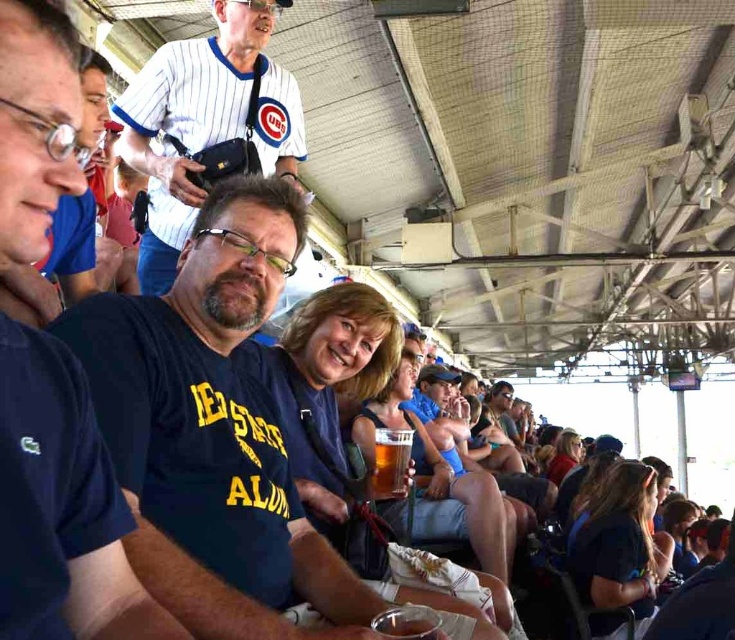
You are standing at the point labeled point (x=154, y=148) in the baseball stadium. If you want to take a photo of the entire stadium, where should you position yourself relative to this point?

You should move away from the point labeled point (x=154, y=148) because the camera is currently 13.86 feet away from this point, which might be too close to capture the entire stadium in one frame.

You are a photographer standing at the center of the baseball stadium. You notice two points marked in the image. The first point is at coordinate point (223, 579) and the second is at point (118, 579). If you want to take a photo that includes both points, which point should you focus on first to ensure both are in focus?

You should focus on point (223, 579) first because it is closer to the camera than point (118, 579). Since it is closer, focusing on it will ensure the farther point remains in focus as well.

You are a photographer at the baseball stadium and want to capture a photo of the white pinstriped jersey at upper center. You notice a point marked at coordinates [204,122]. Is this point located on the white pinstriped jersey at upper center?

Yes, the point [204,122] is located on the white pinstriped jersey at upper center.